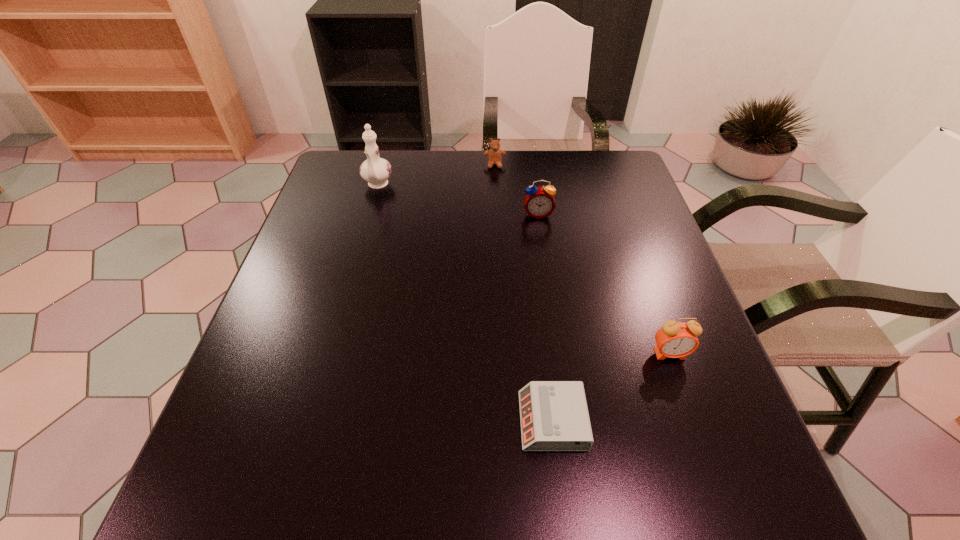
This screenshot has height=540, width=960. In the image, there is a desktop. Find the location of `vacant space at the near edge`. vacant space at the near edge is located at coordinates [457, 521].

This screenshot has width=960, height=540. Find the location of `vacant area at the left edge`. vacant area at the left edge is located at coordinates (320, 213).

Find the location of `vacant space at the right edge of the desktop`. vacant space at the right edge of the desktop is located at coordinates (669, 443).

The image size is (960, 540). I want to click on vacant space at the far left corner, so click(x=354, y=191).

Where is `free space at the far right corner`? free space at the far right corner is located at coordinates (601, 187).

Where is `free space between the fourth farthest object and the nearest alarm clock`? free space between the fourth farthest object and the nearest alarm clock is located at coordinates (612, 387).

I want to click on blank region between the tallest object and the nearest object, so click(465, 303).

This screenshot has height=540, width=960. I want to click on vacant space that is in between the leftmost object and the nearest alarm clock, so click(465, 303).

Image resolution: width=960 pixels, height=540 pixels. I want to click on empty space between the third nearest object and the shortest alarm clock, so click(x=545, y=317).

Locate an element on the screen. This screenshot has height=540, width=960. vacant point located between the farthest alarm clock and the second nearest alarm clock is located at coordinates (604, 284).